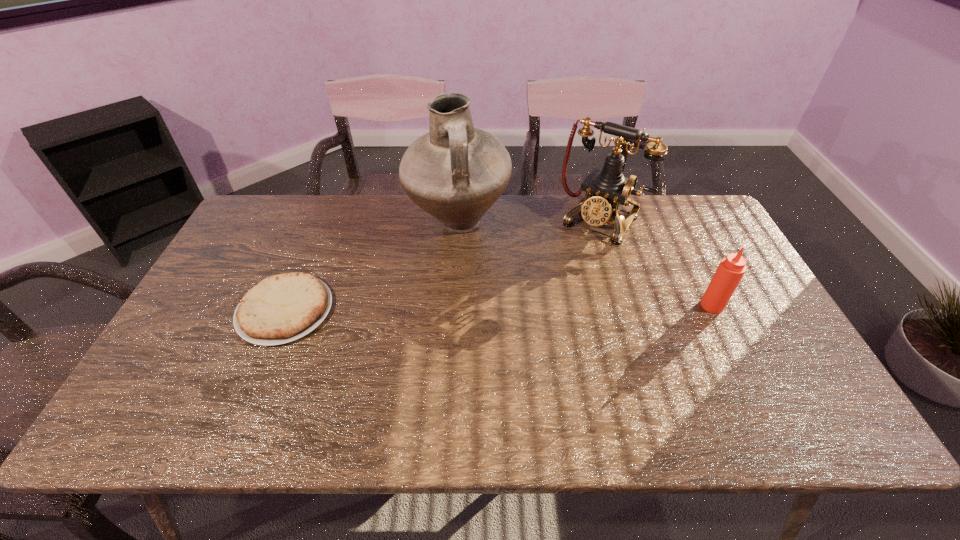
The height and width of the screenshot is (540, 960). In order to click on empty space between the rightmost object and the second tallest object in this screenshot , I will do `click(657, 263)`.

Locate an element on the screen. blank region between the pitcher and the second tallest object is located at coordinates (530, 222).

Identify the location of blank region between the pitcher and the second tallest object. pyautogui.click(x=530, y=222).

Image resolution: width=960 pixels, height=540 pixels. I want to click on vacant point located between the shortest object and the tallest object, so click(372, 267).

Where is `unoccupied area between the shortest object and the tallest object`? unoccupied area between the shortest object and the tallest object is located at coordinates (372, 267).

Find the location of a particular element. This screenshot has width=960, height=540. object that stands as the second closest to the telephone is located at coordinates (731, 269).

This screenshot has width=960, height=540. I want to click on object that is the third closest to the leftmost object, so click(731, 269).

Image resolution: width=960 pixels, height=540 pixels. Find the location of `free space that satisfies the following two spatial constraints: 1. on the back side of the shortest object; 2. on the right side of the Tabasco sauce`. free space that satisfies the following two spatial constraints: 1. on the back side of the shortest object; 2. on the right side of the Tabasco sauce is located at coordinates (287, 306).

Where is `vacant area that satisfies the following two spatial constraints: 1. on the back side of the shortest object; 2. on the left side of the second tallest object`? The width and height of the screenshot is (960, 540). vacant area that satisfies the following two spatial constraints: 1. on the back side of the shortest object; 2. on the left side of the second tallest object is located at coordinates (323, 221).